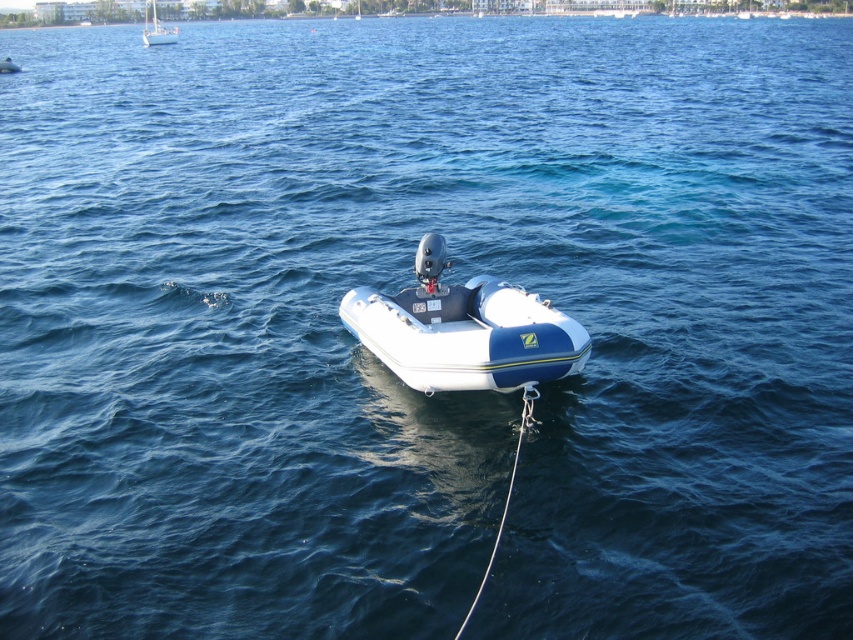
Question: Which point is farther from the camera taking this photo?

Choices:
 (A) (148, 33)
 (B) (585, 352)
 (C) (0, 68)

Answer: (A)

Question: Is white rubber boat at center further to the viewer compared to white glossy sailboat at upper left?

Choices:
 (A) no
 (B) yes

Answer: (A)

Question: Is white rubber boat at center to the right of blue rubber boat at center from the viewer's perspective?

Choices:
 (A) yes
 (B) no

Answer: (A)

Question: Among these points, which one is farthest from the camera?

Choices:
 (A) (12, 65)
 (B) (509, 381)

Answer: (A)

Question: Is white rubber boat at center bigger than white glossy sailboat at upper left?

Choices:
 (A) no
 (B) yes

Answer: (A)

Question: Which point is closer to the camera taking this photo?

Choices:
 (A) [x=445, y=390]
 (B) [x=4, y=65]

Answer: (A)